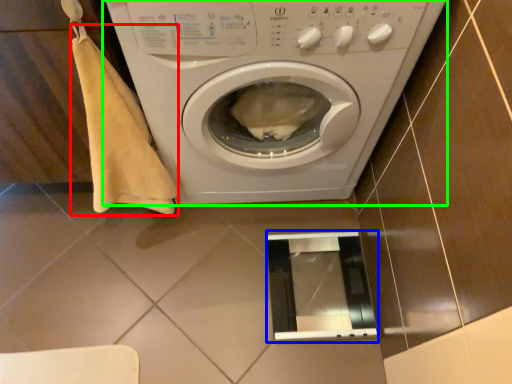
Question: Based on their relative distances, which object is nearer to blanket (highlighted by a red box)? Choose from screen door (highlighted by a blue box) and washing machine (highlighted by a green box).

Choices:
 (A) screen door
 (B) washing machine

Answer: (B)